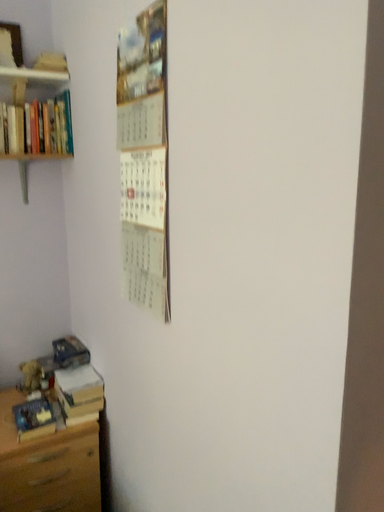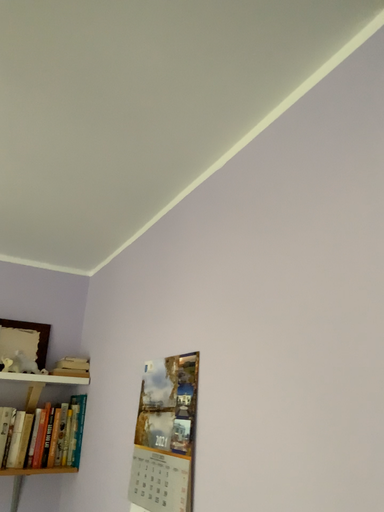
Question: How did the camera likely rotate when shooting the video?

Choices:
 (A) rotated downward
 (B) rotated upward

Answer: (B)